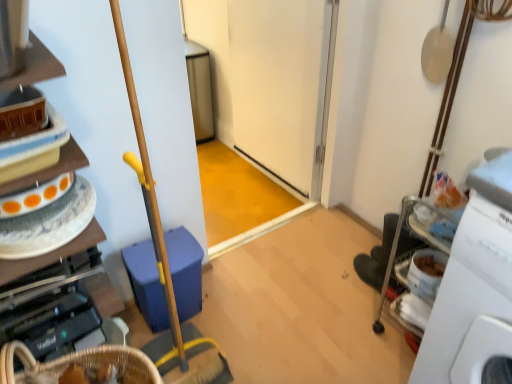
Describe the element at coordinates (475, 290) in the screenshot. I see `white plastic machine at right` at that location.

Find the location of `white plastic machine at right`. white plastic machine at right is located at coordinates (475, 290).

Describe the element at coordinates (51, 254) in the screenshot. Image resolution: width=512 pixels, height=384 pixels. I see `wooden cabinet at left` at that location.

What is the approximate height of wooden cabinet at left?

8.57 inches.

Where is `wooden cabinet at left`? This screenshot has height=384, width=512. wooden cabinet at left is located at coordinates (51, 254).

You are a GUI agent. You are given a task and a screenshot of the screen. Output one action in this format:
    pyautogui.click(x=<x>, y=<y>)
    Task: Click on the white plastic machine at right
    The width and height of the screenshot is (512, 384).
    Given the screenshot: What is the action you would take?
    pyautogui.click(x=475, y=290)

Considering the relative positions of white plastic machine at right and wooden cabinet at left in the image provided, is white plastic machine at right to the left of wooden cabinet at left from the viewer's perspective?

No.

Does white plastic machine at right lie in front of wooden cabinet at left?

Yes.

Which point is more distant from viewer, (475, 324) or (87, 160)?

The point (87, 160) is farther.

From the image's perspective, is white plastic machine at right located above or below wooden cabinet at left?

white plastic machine at right is below wooden cabinet at left.

From a real-world perspective, is white plastic machine at right positioned above or below wooden cabinet at left?

white plastic machine at right is situated lower than wooden cabinet at left in the real world.

Is white plastic machine at right wider than wooden cabinet at left?

Indeed, white plastic machine at right has a greater width compared to wooden cabinet at left.

Can you confirm if white plastic machine at right is taller than wooden cabinet at left?

→ Yes.

Considering the sizes of objects white plastic machine at right and wooden cabinet at left in the image provided, who is smaller, white plastic machine at right or wooden cabinet at left?

With smaller size is wooden cabinet at left.

Is white plastic machine at right located outside wooden cabinet at left?

Yes.

Does white plastic machine at right touch wooden cabinet at left?

No, white plastic machine at right is not next to wooden cabinet at left.

Does white plastic machine at right turn towards wooden cabinet at left?

No, white plastic machine at right is not facing towards wooden cabinet at left.

I want to click on machine that is under the wooden cabinet at left (from a real-world perspective), so click(475, 290).

Considering the relative positions of wooden cabinet at left and white plastic machine at right in the image provided, is wooden cabinet at left to the right of white plastic machine at right from the viewer's perspective?

Incorrect, wooden cabinet at left is not on the right side of white plastic machine at right.

Considering the positions of objects wooden cabinet at left and white plastic machine at right in the image provided, who is behind, wooden cabinet at left or white plastic machine at right?

wooden cabinet at left is further from the camera.

Considering the positions of point (31, 68) and point (444, 313), is point (31, 68) closer or farther from the camera than point (444, 313)?

Clearly, point (31, 68) is closer to the camera than point (444, 313).

From the image's perspective, is wooden cabinet at left on white plastic machine at right?

Yes, from the image's perspective, wooden cabinet at left is over white plastic machine at right.

From a real-world perspective, who is located lower, wooden cabinet at left or white plastic machine at right?

white plastic machine at right.

Considering the sizes of objects wooden cabinet at left and white plastic machine at right in the image provided, who is thinner, wooden cabinet at left or white plastic machine at right?

With smaller width is wooden cabinet at left.

Considering the sizes of objects wooden cabinet at left and white plastic machine at right in the image provided, who is shorter, wooden cabinet at left or white plastic machine at right?

Standing shorter between the two is wooden cabinet at left.

Can you confirm if wooden cabinet at left is smaller than white plastic machine at right?

Correct, wooden cabinet at left occupies less space than white plastic machine at right.

Would you say wooden cabinet at left is outside white plastic machine at right?

That's correct, wooden cabinet at left is outside of white plastic machine at right.

Is wooden cabinet at left next to white plastic machine at right and touching it?

No, wooden cabinet at left is not beside white plastic machine at right.

Is wooden cabinet at left facing away from white plastic machine at right?

No, wooden cabinet at left's orientation is not away from white plastic machine at right.

What's the angular difference between wooden cabinet at left and white plastic machine at right's facing directions?

The angle between the facing direction of wooden cabinet at left and the facing direction of white plastic machine at right is 90 degrees.

In order to click on machine lying on the right of wooden cabinet at left in this screenshot , I will do `click(475, 290)`.

Find the location of a particular element. The height and width of the screenshot is (384, 512). machine to the right of wooden cabinet at left is located at coordinates (475, 290).

Identify the location of machine beneath the wooden cabinet at left (from a real-world perspective). The image size is (512, 384). (475, 290).